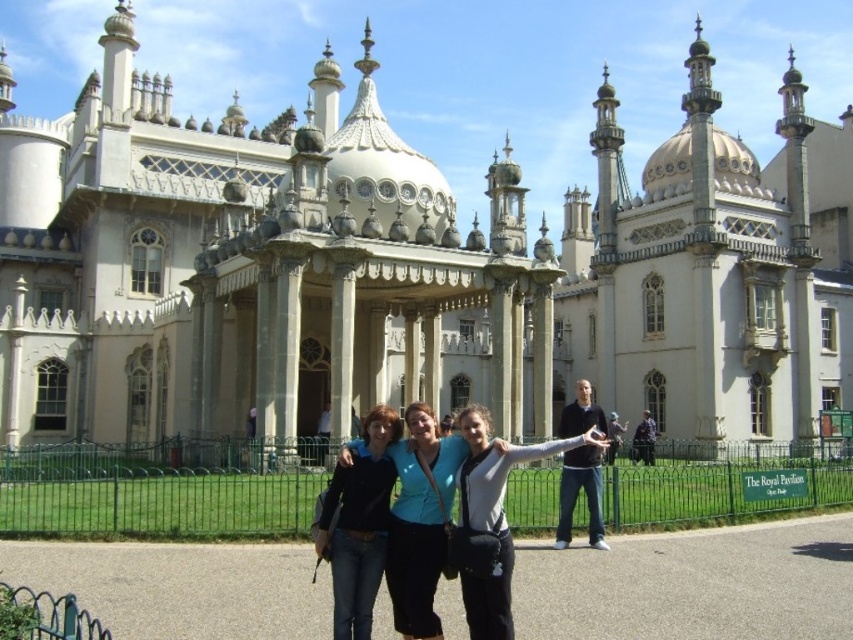
Based on the photo, you are standing at the point with coordinates (408, 269) in the image. What structure can you see directly in front of you?

The structure directly in front of you at point (408, 269) is the white stone palace at center.

You are a photographer trying to capture a clear shot of both the matte blue shirt at center and the black fabric jacket at center. Based on their positions, which one might be partially obscured in the photo?

The black fabric jacket at center is behind the matte blue shirt at center, so it might be partially obscured in the photo.